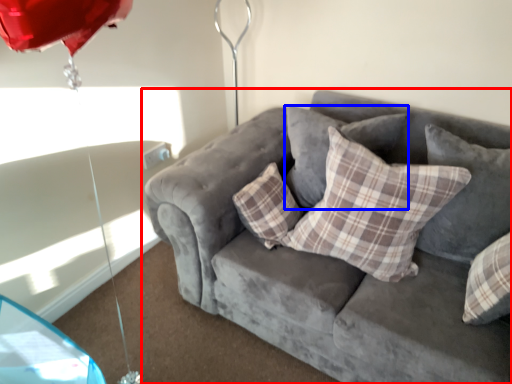
Question: Which object appears farthest to the camera in this image, studio couch (highlighted by a red box) or pillow (highlighted by a blue box)?

Choices:
 (A) studio couch
 (B) pillow

Answer: (B)